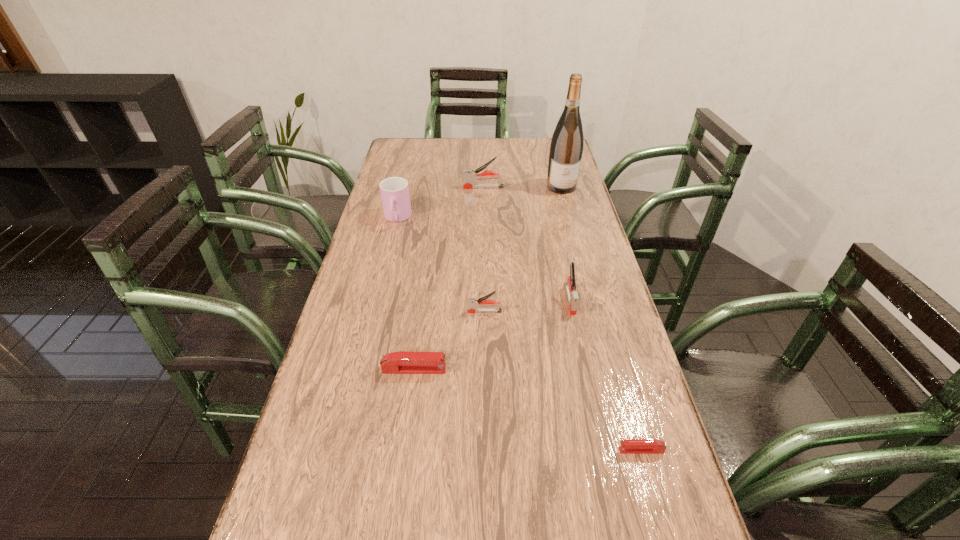
Image resolution: width=960 pixels, height=540 pixels. What are the coordinates of `the tallest object` in the screenshot? It's located at (566, 148).

The height and width of the screenshot is (540, 960). Find the location of `brown wine bottle`. brown wine bottle is located at coordinates (566, 148).

Find the location of `the biggest gray stapler`. the biggest gray stapler is located at coordinates (469, 176).

The width and height of the screenshot is (960, 540). Find the location of `the farthest gray stapler`. the farthest gray stapler is located at coordinates (469, 176).

This screenshot has width=960, height=540. In order to click on the leftmost object in this screenshot , I will do `click(394, 191)`.

This screenshot has height=540, width=960. I want to click on cup, so click(x=394, y=191).

I want to click on the second stapler from right to left, so click(570, 285).

Identify the location of the fourth shortest stapler. (570, 285).

Locate an element on the screen. The height and width of the screenshot is (540, 960). the smallest gray stapler is located at coordinates (473, 303).

At what (x,y) coordinates should I click in order to perform the action: click on the third shortest stapler. Please return your answer as a coordinate pair (x, y). Looking at the image, I should click on (473, 303).